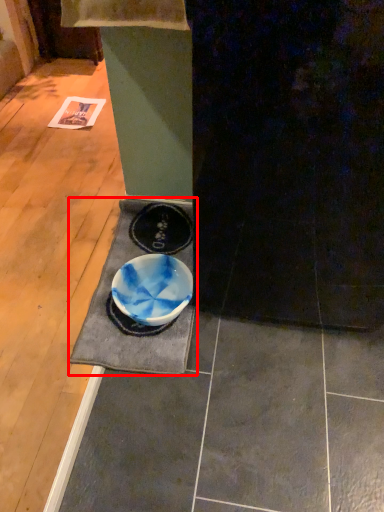
Question: Considering the relative positions of doormat (annotated by the red box) and bowl in the image provided, where is doormat (annotated by the red box) located with respect to the staircase?

Choices:
 (A) left
 (B) right

Answer: (A)